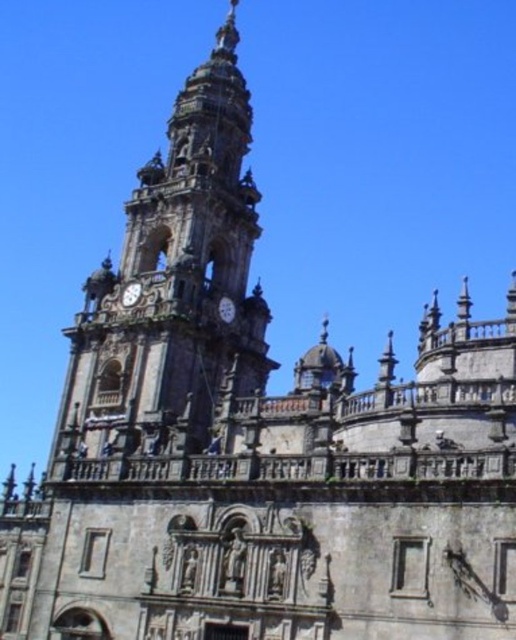
Can you confirm if silver metallic clock at center is taller than matte gray clock at center?

Correct, silver metallic clock at center is much taller as matte gray clock at center.

Is point (125, 307) farther from camera compared to point (221, 317)?

No, it is in front of (221, 317).

At what (x,y) coordinates should I click in order to perform the action: click on silver metallic clock at center. Please return your answer as a coordinate pair (x, y). The height and width of the screenshot is (640, 516). Looking at the image, I should click on (131, 294).

Is point (185, 220) positioned before point (224, 310)?

No, it is not.

Can you confirm if stone clock tower at center is positioned below matte gray clock at center?

Incorrect, stone clock tower at center is not positioned below matte gray clock at center.

Find the location of a particular element. The height and width of the screenshot is (640, 516). stone clock tower at center is located at coordinates (171, 292).

Is stone clock tower at center shorter than silver metallic clock at center?

No.

Who is shorter, stone clock tower at center or silver metallic clock at center?

silver metallic clock at center is shorter.

The image size is (516, 640). I want to click on stone clock tower at center, so click(171, 292).